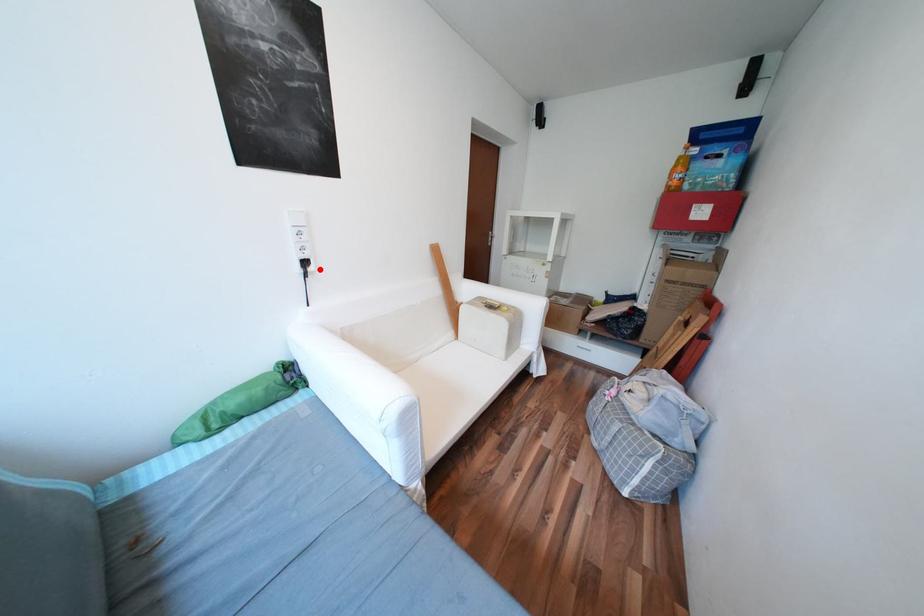
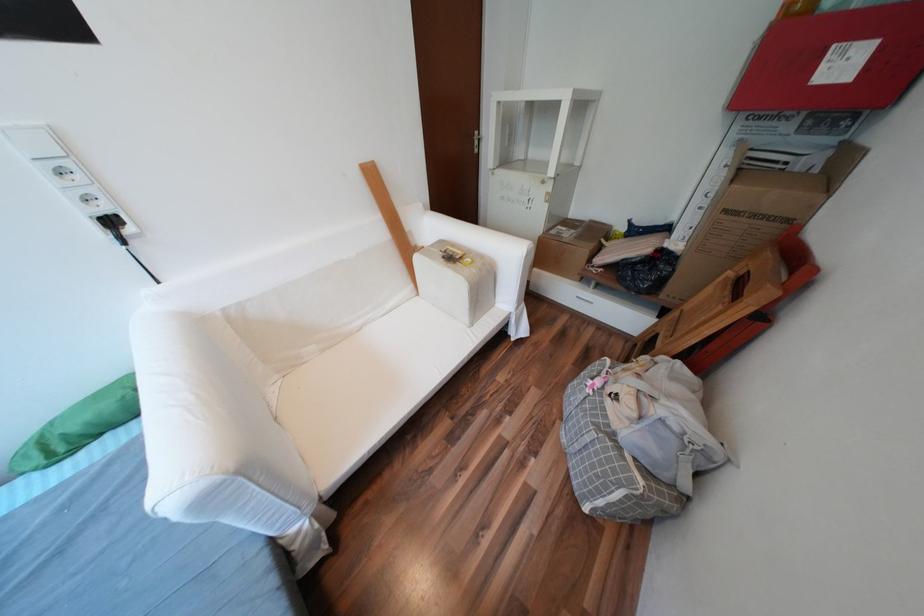
Question: I am providing you with two images of the same scene from different viewpoints. A red point is marked on the first image. Can you still see the location of the red point in image 2?

Choices:
 (A) Yes
 (B) No

Answer: (A)